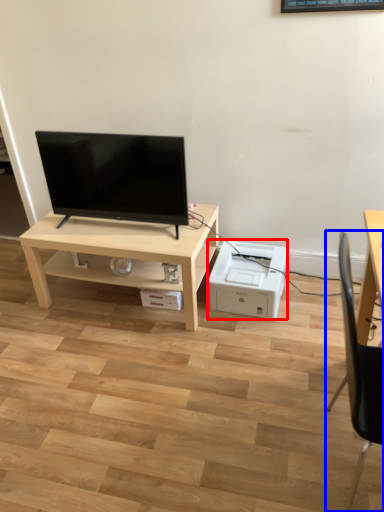
Question: Which object appears farthest to the camera in this image, printer (highlighted by a red box) or chair (highlighted by a blue box)?

Choices:
 (A) printer
 (B) chair

Answer: (A)